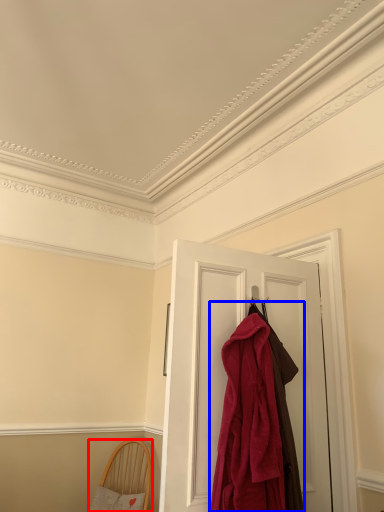
Question: Which of the following is the farthest to the observer, furniture (highlighted by a red box) or cloak (highlighted by a blue box)?

Choices:
 (A) furniture
 (B) cloak

Answer: (A)